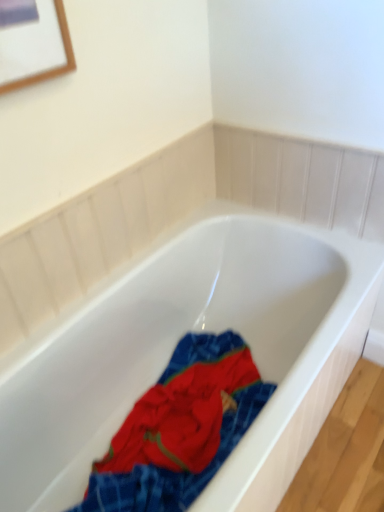
Question: In terms of size, does textured cotton towel at center appear bigger or smaller than white glossy bathtub at center?

Choices:
 (A) small
 (B) big

Answer: (A)

Question: Is point (150, 424) positioned closer to the camera than point (19, 505)?

Choices:
 (A) farther
 (B) closer

Answer: (A)

Question: From a real-world perspective, is textured cotton towel at center positioned above or below white glossy bathtub at center?

Choices:
 (A) below
 (B) above

Answer: (A)

Question: Is white glossy bathtub at center in front of or behind textured cotton towel at center in the image?

Choices:
 (A) behind
 (B) front

Answer: (B)

Question: Is white glossy bathtub at center inside the boundaries of textured cotton towel at center, or outside?

Choices:
 (A) inside
 (B) outside

Answer: (B)

Question: In the image, is white glossy bathtub at center on the left side or the right side of textured cotton towel at center?

Choices:
 (A) left
 (B) right

Answer: (B)

Question: From the image's perspective, relative to textured cotton towel at center, is white glossy bathtub at center above or below?

Choices:
 (A) above
 (B) below

Answer: (A)